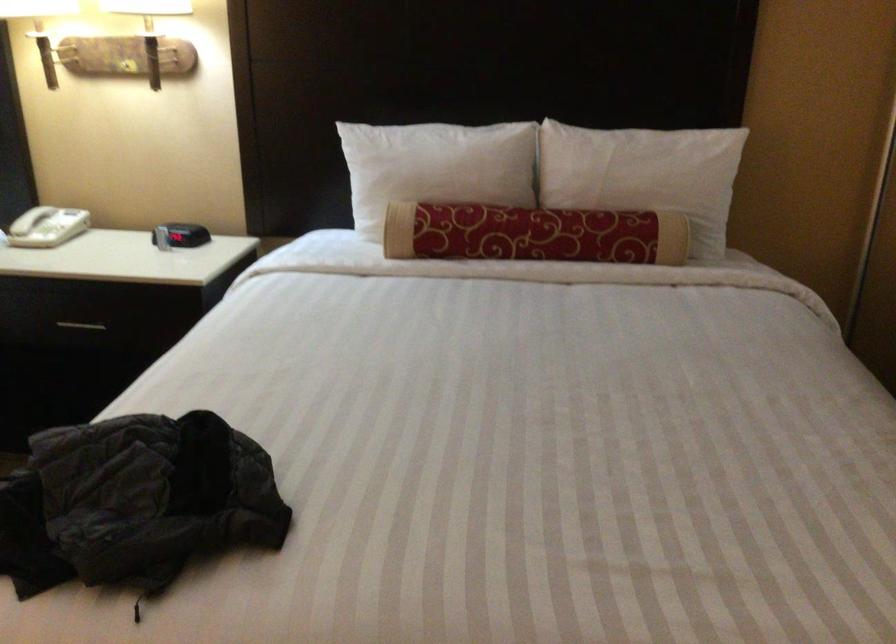
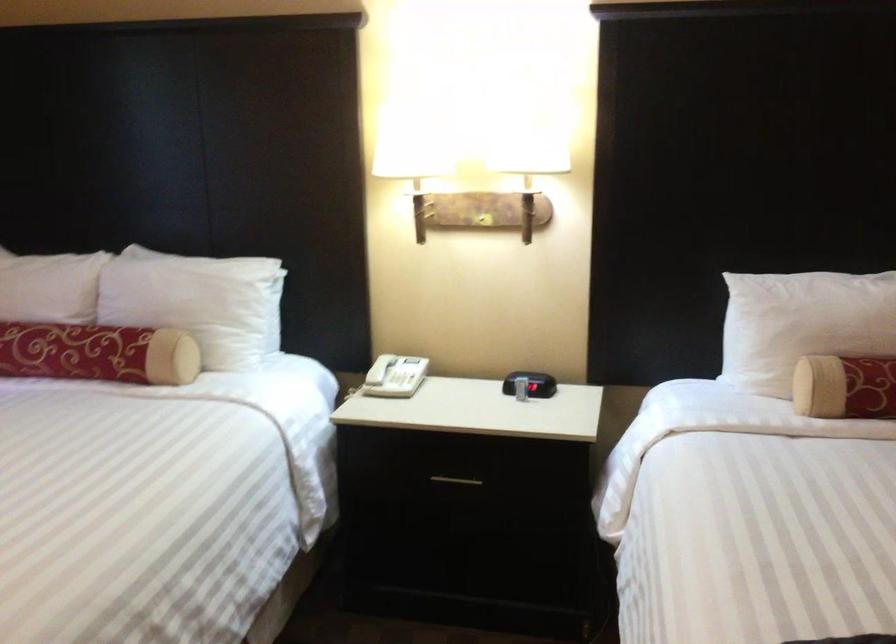
Question: The images are taken continuously from a first-person perspective. In which direction are you moving?

Choices:
 (A) Left
 (B) Right
 (C) Forward
 (D) Backward

Answer: (A)